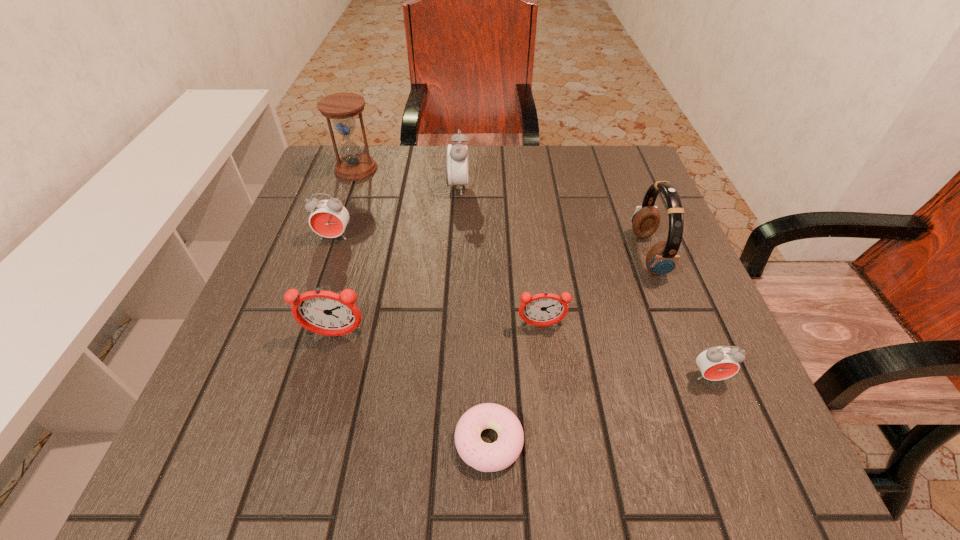
Image resolution: width=960 pixels, height=540 pixels. Identify the location of the nearest alarm clock. (716, 363).

You are a GUI agent. You are given a task and a screenshot of the screen. Output one action in this format:
    pyautogui.click(x=<x>, y=<y>)
    Task: Click on the nearest object
    This screenshot has height=540, width=960.
    Given the screenshot: What is the action you would take?
    coord(487,457)

What are the coordinates of `the shortest object` in the screenshot? It's located at (487, 457).

Identify the location of free space located on the right of the hourglass. The width and height of the screenshot is (960, 540). coord(465,169).

Where is `vacant space situated 0.370m on the ear cup of the headset`? vacant space situated 0.370m on the ear cup of the headset is located at coordinates (459, 254).

What are the coordinates of `free space located on the ear cup of the headset` in the screenshot? It's located at (483, 254).

You are a GUI agent. You are given a task and a screenshot of the screen. Output one action in this format:
    pyautogui.click(x=<x>, y=<y>)
    Task: Click on the free space located on the ear cup of the headset
    The height and width of the screenshot is (540, 960).
    Given the screenshot: What is the action you would take?
    pyautogui.click(x=473, y=254)

Locate an element on the screen. This screenshot has width=960, height=540. free spot located 0.140m on the face of the farthest alarm clock is located at coordinates (525, 187).

I want to click on vacant region located 0.170m on the front-facing side of the bigger reddish-pink alarm clock, so click(306, 436).

Image resolution: width=960 pixels, height=540 pixels. Identify the location of free region located 0.200m on the face of the second nearest red alarm clock. pyautogui.click(x=307, y=316).